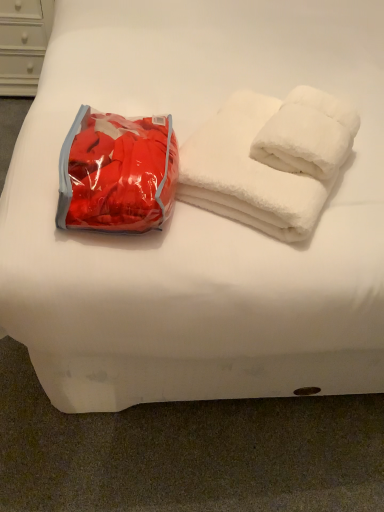
Question: Is point (144, 176) closer or farther from the camera than point (231, 167)?

Choices:
 (A) closer
 (B) farther

Answer: (A)

Question: In terms of size, does matte red bean bag chair at left appear bigger or smaller than white fluffy towels at upper right?

Choices:
 (A) small
 (B) big

Answer: (A)

Question: In the image, is matte red bean bag chair at left positioned in front of or behind white fluffy towels at upper right?

Choices:
 (A) behind
 (B) front

Answer: (B)

Question: In terms of height, does white fluffy towels at upper right look taller or shorter compared to matte red bean bag chair at left?

Choices:
 (A) tall
 (B) short

Answer: (A)

Question: From a real-world perspective, is white fluffy towels at upper right positioned above or below matte red bean bag chair at left?

Choices:
 (A) below
 (B) above

Answer: (A)

Question: Is white fluffy towels at upper right wider or thinner than matte red bean bag chair at left?

Choices:
 (A) thin
 (B) wide

Answer: (B)

Question: Is white fluffy towels at upper right inside or outside of matte red bean bag chair at left?

Choices:
 (A) outside
 (B) inside

Answer: (A)